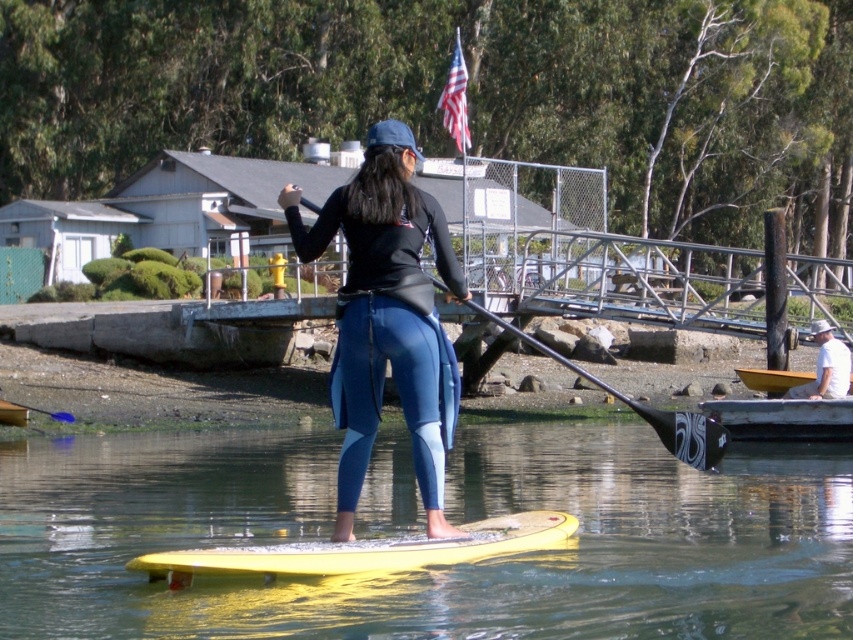
In the scene shown: You are a photographer taking a picture of the waterfront scene. You notice the white cotton shirt at lower right and the yellow plastic kayak at lower left in your camera frame. Which object is positioned higher in the frame?

The white cotton shirt at lower right is positioned higher in the frame than the yellow plastic kayak at lower left.

You are a photographer positioned at the center of the image. You want to capture a photo of the white cotton shirt at lower right without including the American flag in the background. Is the shirt positioned in a way that allows this?

The white cotton shirt at lower right is located at point [825,365], which is positioned away from the American flag, so yes, the photographer can capture the shirt without including the flag in the background.

From the picture: You are planning to rent a watercraft for a solo trip. The rental company requires that the watercraft be at least 2 meters wide to accommodate your gear. You see the yellow rubber paddleboard at center and the wooden kayak at lower right. Which one is more likely to meet the width requirement?

The yellow rubber paddleboard at center is more likely to meet the width requirement because its width is larger than the wooden kayak at lower right, and the requirement is at least 2 meters.